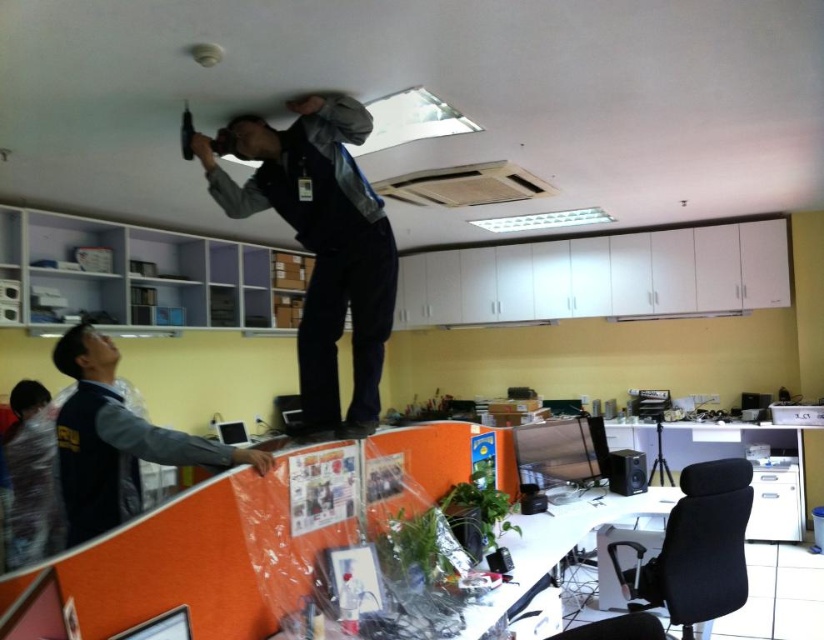
Is point (76, 352) closer to camera compared to point (10, 497)?

Yes, point (76, 352) is closer to viewer.

Which of these two, blue fabric jacket at lower left or plastic bag at lower left, stands taller?

blue fabric jacket at lower left is taller.

I want to click on blue fabric jacket at lower left, so click(x=116, y=440).

Does gray fabric jacket at upper center have a smaller size compared to plastic bag at lower left?

Correct, gray fabric jacket at upper center occupies less space than plastic bag at lower left.

In the scene shown: Which is more to the left, gray fabric jacket at upper center or plastic bag at lower left?

plastic bag at lower left is more to the left.

Does point (295, 209) lie in front of point (38, 499)?

Yes, it is in front of point (38, 499).

Image resolution: width=824 pixels, height=640 pixels. Identify the location of gray fabric jacket at upper center. (321, 243).

Consider the image. Is plastic bag at lower left to the right of matte black computer at upper center from the viewer's perspective?

No, plastic bag at lower left is not to the right of matte black computer at upper center.

Where is `plastic bag at lower left`? This screenshot has width=824, height=640. plastic bag at lower left is located at coordinates (31, 477).

Find the location of a particular element. plastic bag at lower left is located at coordinates (31, 477).